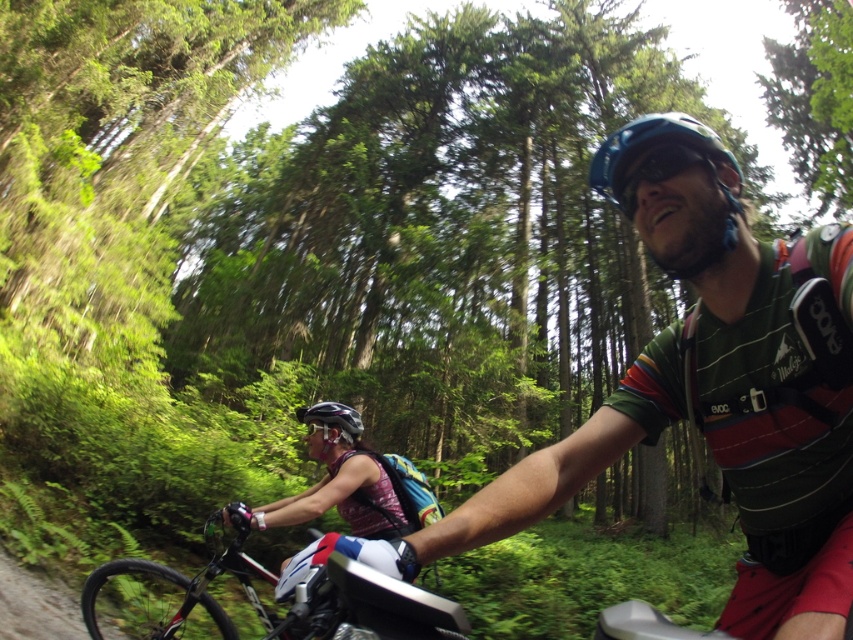
Between shiny metallic bike at center and matte black helmet at lower center, which one has more height?

shiny metallic bike at center is taller.

Can you confirm if shiny metallic bike at center is shorter than matte black helmet at lower center?

No, shiny metallic bike at center is not shorter than matte black helmet at lower center.

Does point (354, 600) lie in front of point (352, 416)?

Yes, it is in front of point (352, 416).

The width and height of the screenshot is (853, 640). I want to click on shiny metallic bike at center, so click(258, 602).

Is point (691, 268) in front of point (323, 429)?

Yes, it is.

Is blue matte helmet at upper center wider than matte black helmet at lower center?

No, blue matte helmet at upper center is not wider than matte black helmet at lower center.

Does point (606, 196) come in front of point (341, 432)?

No, (606, 196) is behind (341, 432).

The width and height of the screenshot is (853, 640). I want to click on blue matte helmet at upper center, so click(665, 172).

Is shiny metallic bike at center taller than blue matte helmet at upper center?

Yes, shiny metallic bike at center is taller than blue matte helmet at upper center.

Consider the image. Does shiny metallic bike at center appear over blue matte helmet at upper center?

No.

Who is more forward, [428,627] or [677,168]?

Point [428,627] is more forward.

The height and width of the screenshot is (640, 853). Identify the location of shiny metallic bike at center. (258, 602).